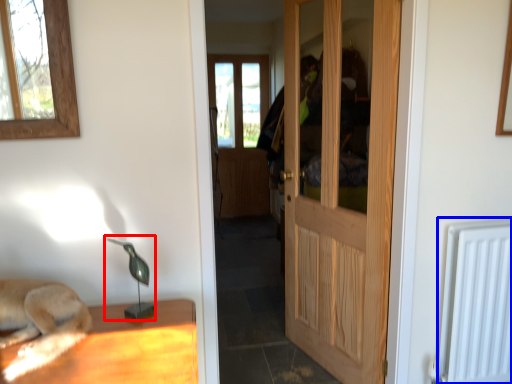
Question: Among these objects, which one is farthest to the camera, table lamp (highlighted by a red box) or radiator (highlighted by a blue box)?

Choices:
 (A) table lamp
 (B) radiator

Answer: (B)